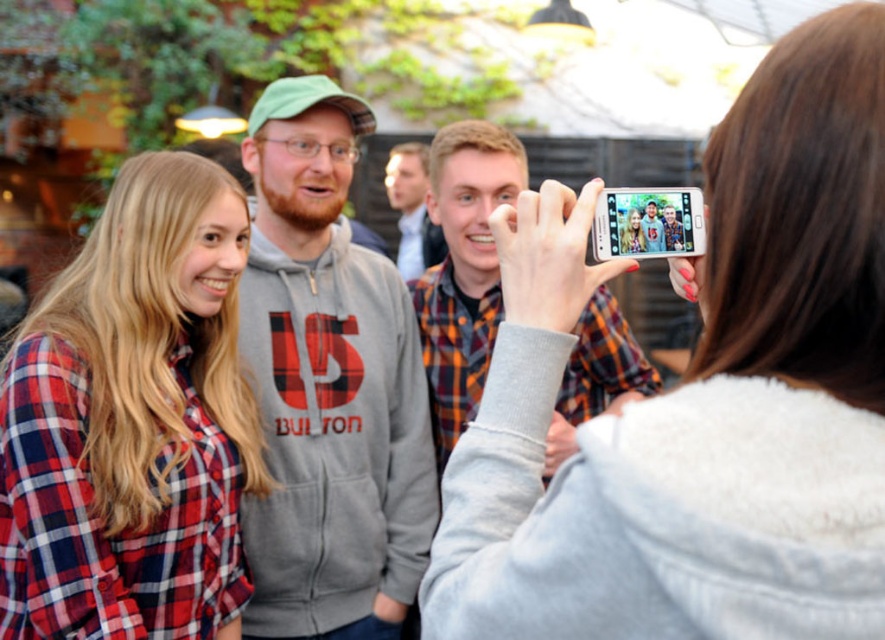
You are a photographer trying to capture a photo of the group. You notice the gray fleece hoodie at center and the silver metallic phone at upper right in your frame. Which object is closer to the bottom of the image?

The gray fleece hoodie at center is positioned under the silver metallic phone at upper right, so it is closer to the bottom of the image.

You are trying to take a photo with your white glossy phone at upper center and wearing your gray fleece hoodie at center. Since the phone is small, will it be easy to hold the phone while keeping your hoodie on?

The white glossy phone at upper center is smaller in width than the gray fleece hoodie at center, so it should be easy to hold the phone while wearing the hoodie since it doesn t take up much space.

You are trying to determine if the gray fleece hoodie at center can fully cover the silver metallic phone at upper right when placed directly over it. Based on their sizes, would the hoodie be wide enough to completely hide the phone?

The gray fleece hoodie at center might be wider than silver metallic phone at upper right, so there is a possibility that the hoodie could cover the phone when placed over it, but the exact coverage depends on their specific dimensions.